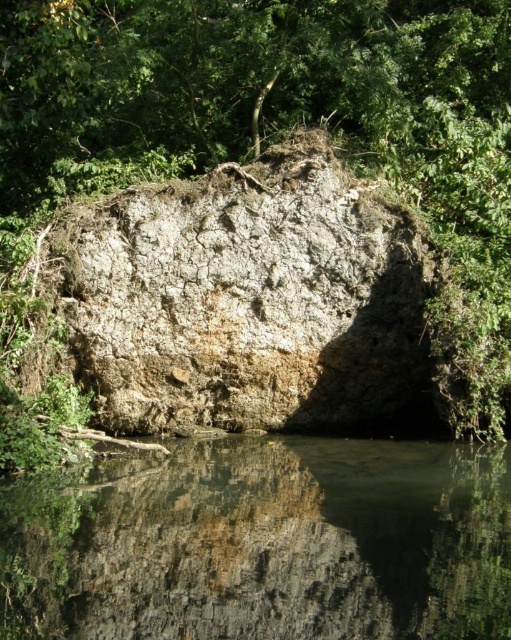
You are a kayaker approaching the gray rough rock at center, which is surrounded by transparent water at center. Can you safely paddle around the rock without hitting it based on their heights?

The transparent water at center is shorter than the gray rough rock at center, so the water is shallower than the rock. This means the rock is partially above the water level, making it visible and possible to navigate around it safely without hitting it.

You are standing on the shore of the lake and see the transparent water at center and the gray rough rock at center. Which object is closer to you?

The transparent water at center is closer to you because it is in front of the gray rough rock at center.